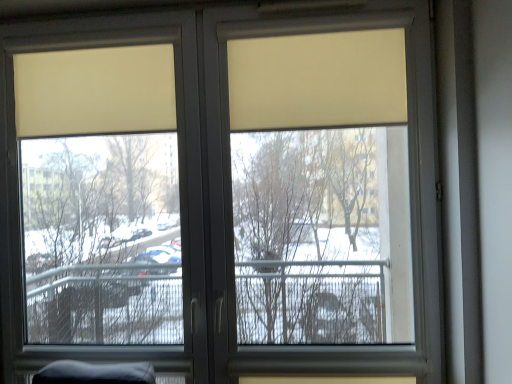
Question: In terms of width, does beige matte curtain at upper left, the first curtain positioned from the left, look wider or thinner when compared to matte plastic window screen at center?

Choices:
 (A) thin
 (B) wide

Answer: (A)

Question: Is beige matte curtain at upper left, the first curtain positioned from the left, taller or shorter than matte plastic window screen at center?

Choices:
 (A) tall
 (B) short

Answer: (B)

Question: Considering the real-world distances, which object is closest to the beige matte curtain at upper left, the first curtain positioned from the left?

Choices:
 (A) matte plastic window screen at center
 (B) beige matte curtain at upper center, the 1th curtain viewed from the right

Answer: (B)

Question: Which is nearer to the matte plastic window screen at center?

Choices:
 (A) beige matte curtain at upper left, the second curtain viewed from the right
 (B) beige matte curtain at upper center, which is the 2th curtain in left-to-right order

Answer: (A)